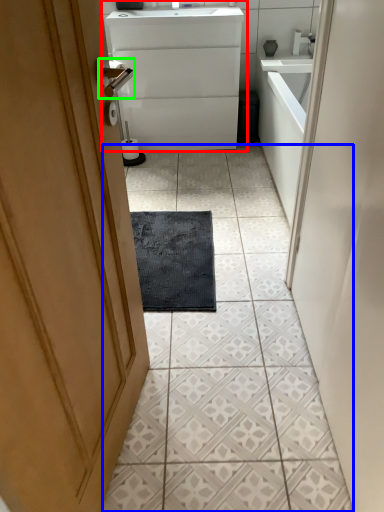
Question: Which object is positioned farthest from bathroom cabinet (highlighted by a red box)? Select from ceramic tile (highlighted by a blue box) and door handle (highlighted by a green box).

Choices:
 (A) ceramic tile
 (B) door handle

Answer: (B)